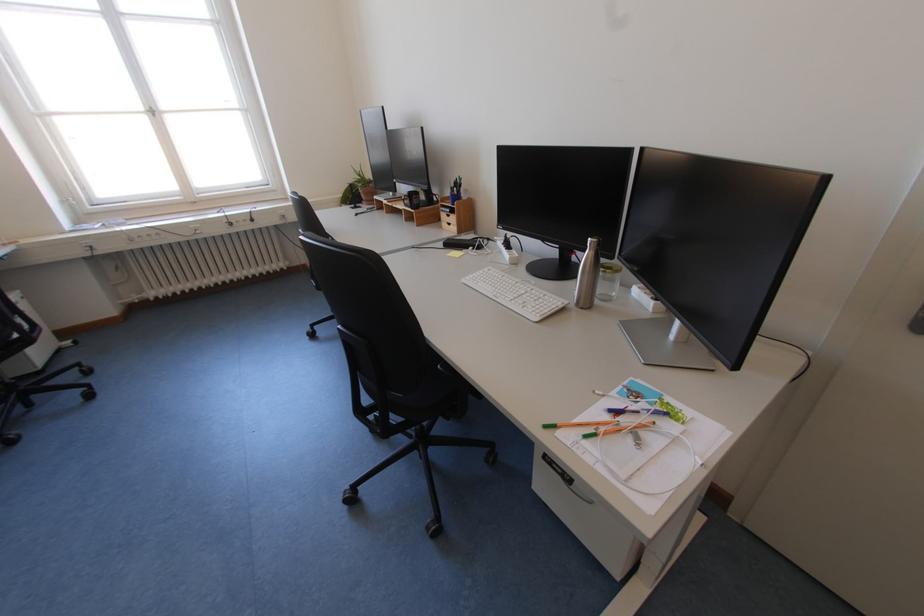
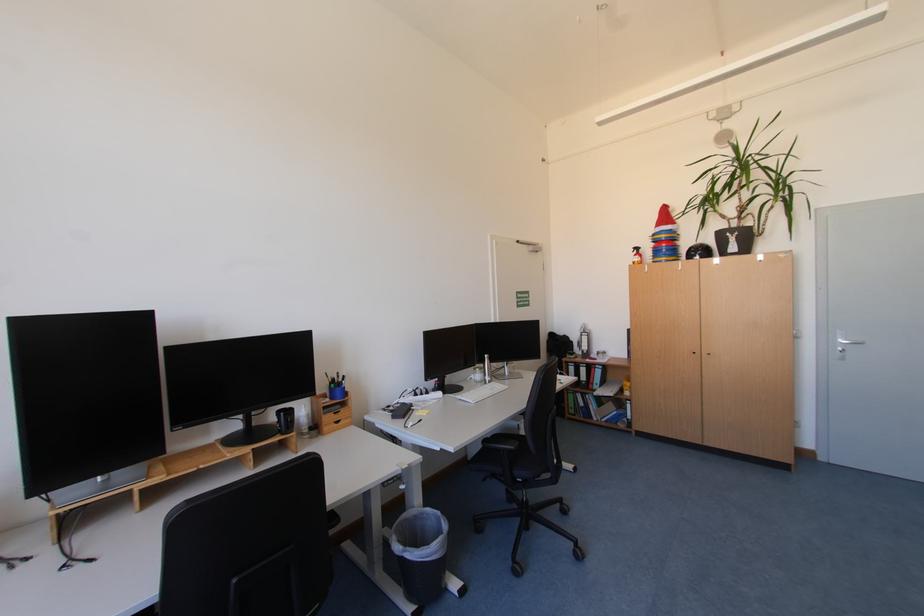
Question: I am providing you with two images of the same scene from different viewpoints. Please identify which objects are invisible in image2.

Choices:
 (A) red binder
 (B) glass jar
 (C) orange spray bottle
 (D) small blue crate

Answer: (B)